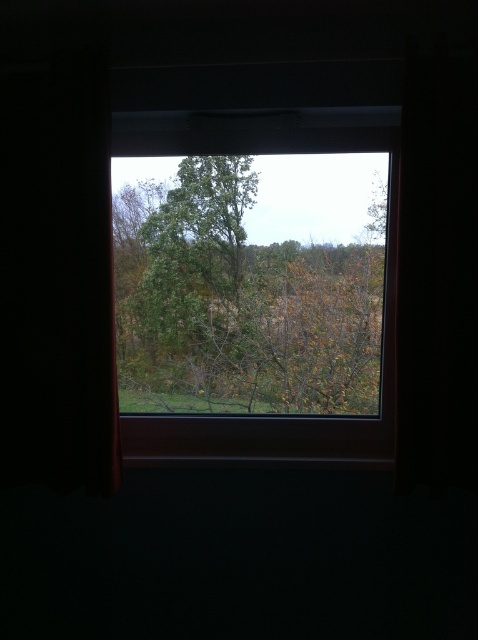
Is point (33, 84) closer to camera compared to point (121, 241)?

That is True.

Can you confirm if black fabric curtain at left is positioned to the right of green leafy tree at center?

Incorrect, black fabric curtain at left is not on the right side of green leafy tree at center.

Does point (78, 356) lie behind point (246, 365)?

No, it is in front of (246, 365).

The width and height of the screenshot is (478, 640). What are the coordinates of `black fabric curtain at left` in the screenshot? It's located at (56, 278).

Which of these two, transparent glass window at center or green leafy tree at center, stands shorter?

green leafy tree at center

Looking at this image, does transparent glass window at center have a lesser width compared to green leafy tree at center?

No.

Between point (324, 456) and point (154, 225), which one is positioned behind?

Positioned behind is point (154, 225).

Where is `transparent glass window at center`? transparent glass window at center is located at coordinates (256, 284).

Which of these two, transparent glass window at center or black fabric curtain at left, stands taller?

black fabric curtain at left

Find the location of a particular element. transparent glass window at center is located at coordinates (256, 284).